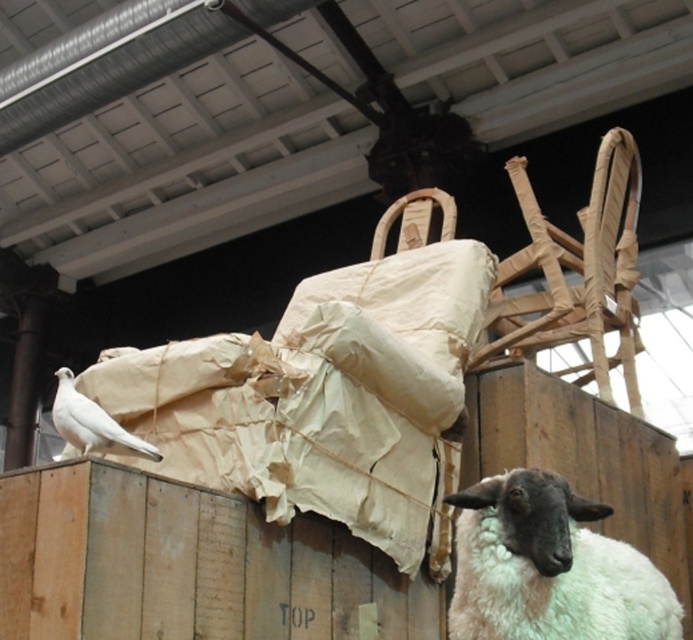
You are a farmer checking the barn. You see the white woolen sheep at lower right and the white matte dove at left. Which animal is wider?

The white woolen sheep at lower right is wider than the white matte dove at left.

You are a farmer checking the barn and see the white woolen sheep at lower right and the white matte dove at left. Which animal is nearer to you?

The white woolen sheep at lower right is closer to the viewer than the white matte dove at left.

You are a farmer checking the barn. You see a white woolen sheep at lower right and a white matte dove at left. Which animal is taller?

The white woolen sheep at lower right is taller than the white matte dove at left.